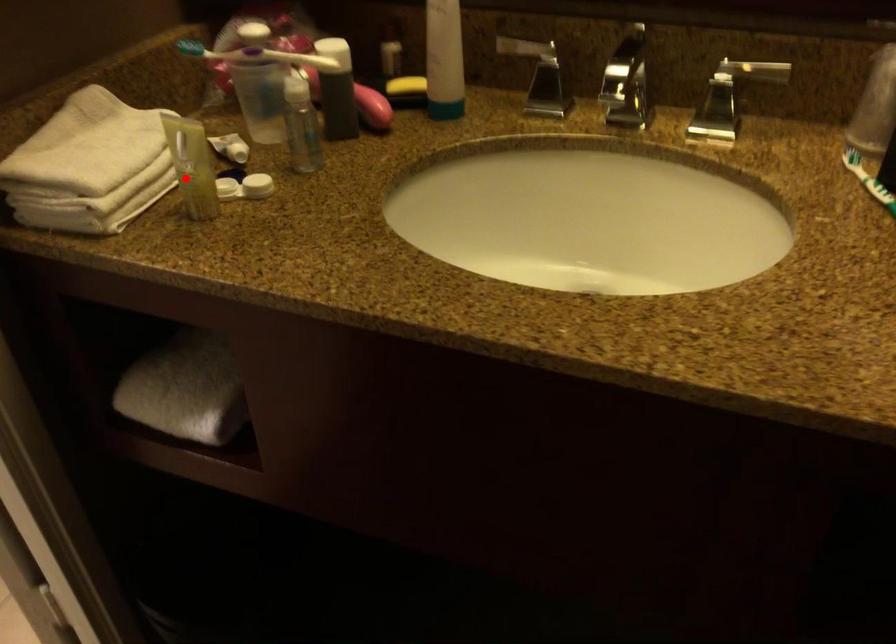
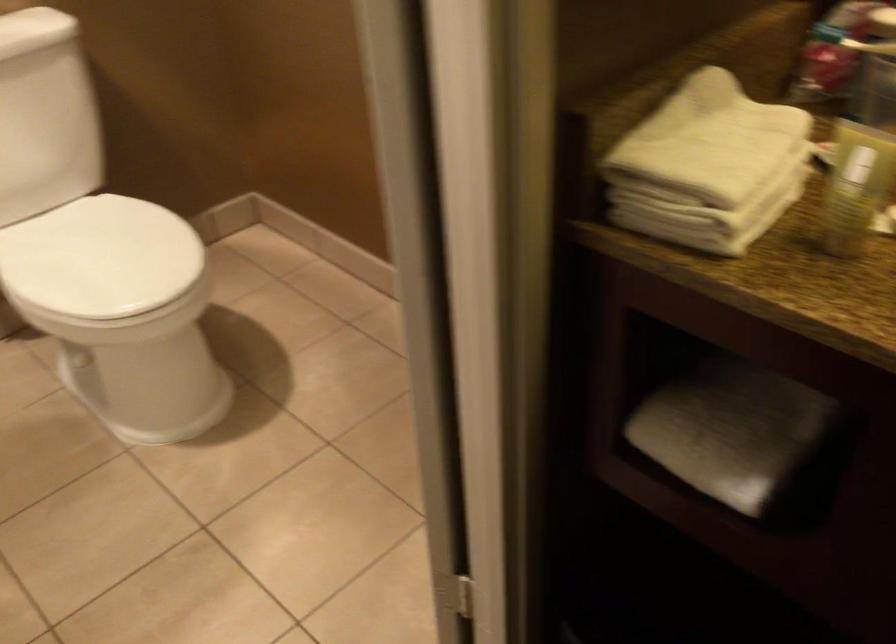
Question: I am providing you with two images of the same scene from different viewpoints. In image1, a red point is highlighted. Considering the same 3D point in image2, which of the following is correct?

Choices:
 (A) It is closer
 (B) It is farther

Answer: (A)